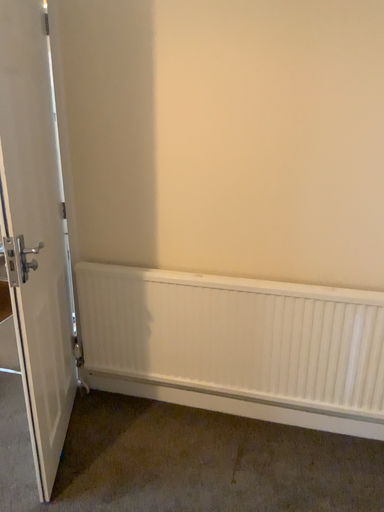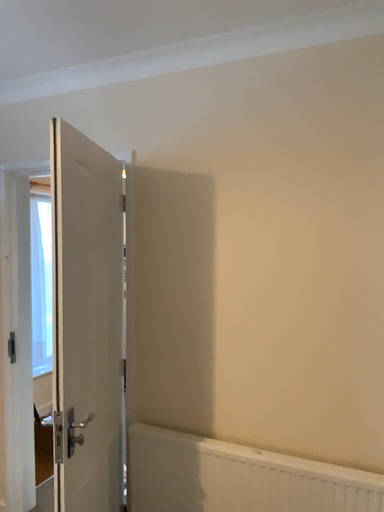
Question: Which way did the camera rotate in the video?

Choices:
 (A) rotated upward
 (B) rotated downward

Answer: (A)